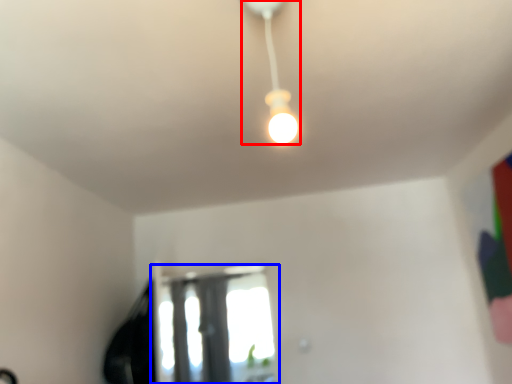
Question: Which object is closer to the camera taking this photo, lamp (highlighted by a red box) or window (highlighted by a blue box)?

Choices:
 (A) lamp
 (B) window

Answer: (A)